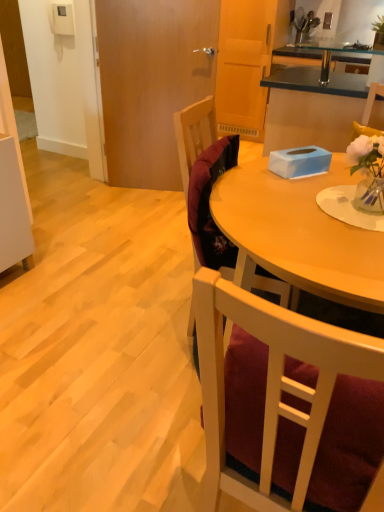
This screenshot has height=512, width=384. Find the location of `vacant space that is to the left of velvet burgundy chair at center, the 2th chair when ordered from front to back`. vacant space that is to the left of velvet burgundy chair at center, the 2th chair when ordered from front to back is located at coordinates (142, 323).